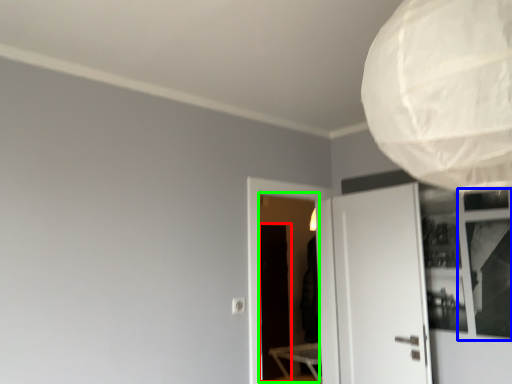
Question: Which object is positioned closest to screen door (highlighted by a red box)? Select from window (highlighted by a blue box) and screen door (highlighted by a green box).

Choices:
 (A) window
 (B) screen door

Answer: (B)